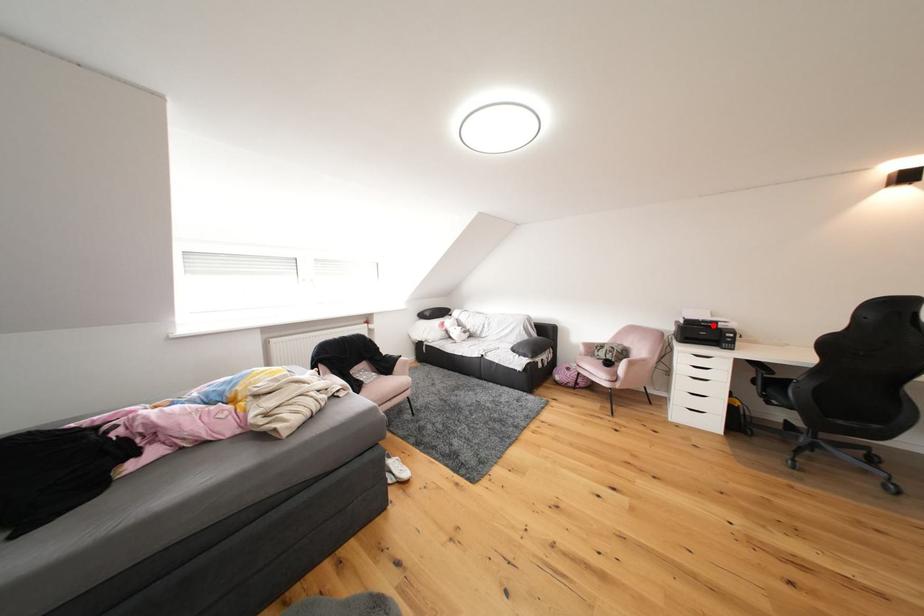
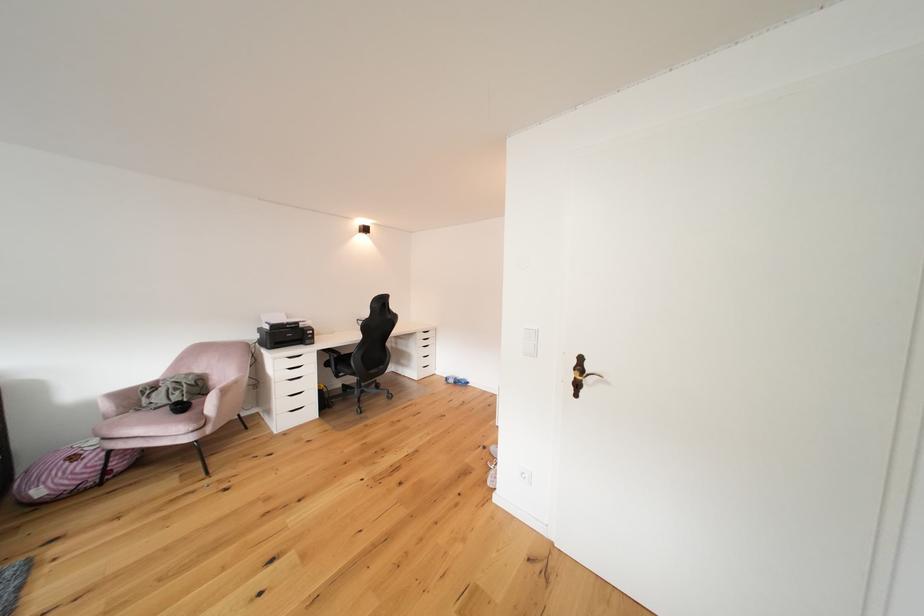
Question: I am providing you with two images of the same scene from different viewpoints. Image1 has a red point marked. In image2, the corresponding 3D location appears at what relative position? Reply with the corresponding letter.

Choices:
 (A) Closer
 (B) Farther

Answer: (A)